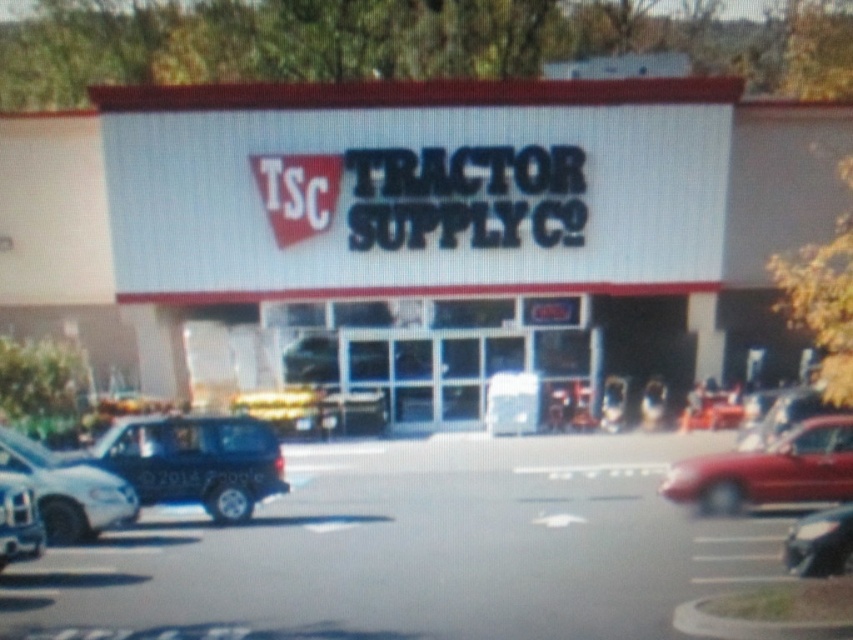
Question: Which point appears farthest from the camera in this image?

Choices:
 (A) (210, 420)
 (B) (6, 465)
 (C) (750, 125)

Answer: (C)

Question: Is white matte truck at lower left positioned behind shiny black sedan at lower right?

Choices:
 (A) no
 (B) yes

Answer: (B)

Question: Is white matte building at center below shiny red car at right?

Choices:
 (A) no
 (B) yes

Answer: (A)

Question: Which object appears farthest from the camera in this image?

Choices:
 (A) shiny black sedan at lower right
 (B) shiny black suv at lower left
 (C) shiny red car at right

Answer: (C)

Question: Is shiny black sedan at lower right to the right of matte black suv at lower left from the viewer's perspective?

Choices:
 (A) yes
 (B) no

Answer: (A)

Question: Which point is farther to the camera?

Choices:
 (A) white matte building at center
 (B) shiny black sedan at lower right
 (C) matte black suv at lower left
 (D) shiny red car at right

Answer: (A)